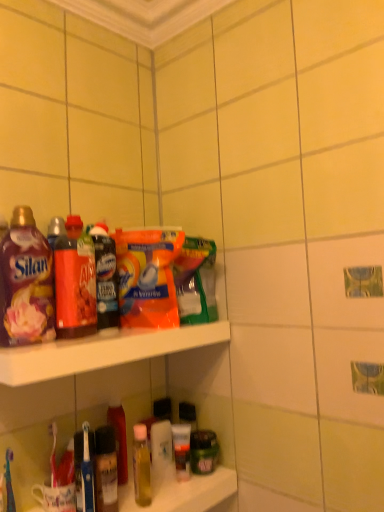
Question: Is orange plastic cleaning product at center surrounded by translucent plastic bottle at lower center, which is counted as the 3th bottle, starting from the front?

Choices:
 (A) no
 (B) yes

Answer: (A)

Question: Is translucent plastic bottle at lower center, which is counted as the 3th bottle, starting from the front, smaller than orange plastic cleaning product at center?

Choices:
 (A) yes
 (B) no

Answer: (A)

Question: From the image's perspective, would you say translucent plastic bottle at lower center, which is counted as the 3th bottle, starting from the front, is positioned over orange plastic cleaning product at center?

Choices:
 (A) yes
 (B) no

Answer: (B)

Question: Considering the relative sizes of translucent plastic bottle at lower center, which is counted as the 3th bottle, starting from the front, and orange plastic cleaning product at center in the image provided, is translucent plastic bottle at lower center, which is counted as the 3th bottle, starting from the front, bigger than orange plastic cleaning product at center?

Choices:
 (A) yes
 (B) no

Answer: (B)

Question: Is the depth of translucent plastic bottle at lower center, which ranks as the 1th bottle in bottom-to-top order, greater than that of orange plastic cleaning product at center?

Choices:
 (A) no
 (B) yes

Answer: (B)

Question: Does translucent plastic bottle at lower center, which ranks as the 1th bottle in bottom-to-top order, appear on the right side of orange plastic cleaning product at center?

Choices:
 (A) yes
 (B) no

Answer: (B)

Question: From the image's perspective, is matte red bottle at left, which is counted as the second bottle, starting from the front, above matte plastic shelf at upper center?

Choices:
 (A) no
 (B) yes

Answer: (B)

Question: Considering the relative positions of matte red bottle at left, placed as the second bottle when sorted from back to front, and matte plastic shelf at upper center in the image provided, is matte red bottle at left, placed as the second bottle when sorted from back to front, in front of matte plastic shelf at upper center?

Choices:
 (A) no
 (B) yes

Answer: (A)

Question: Is matte red bottle at left, arranged as the second bottle when ordered from the bottom, far from matte plastic shelf at upper center?

Choices:
 (A) no
 (B) yes

Answer: (A)

Question: Is matte red bottle at left, arranged as the second bottle when ordered from the bottom, oriented towards matte plastic shelf at upper center?

Choices:
 (A) no
 (B) yes

Answer: (A)

Question: Is matte red bottle at left, which is counted as the second bottle, starting from the front, directly adjacent to matte plastic shelf at upper center?

Choices:
 (A) yes
 (B) no

Answer: (B)

Question: From a real-world perspective, is matte red bottle at left, which is counted as the second bottle, starting from the front, positioned over matte plastic shelf at upper center based on gravity?

Choices:
 (A) yes
 (B) no

Answer: (A)

Question: From a real-world perspective, is matte plastic bottle at upper left located higher than matte red bottle at left, which is counted as the second bottle, starting from the front?

Choices:
 (A) no
 (B) yes

Answer: (A)